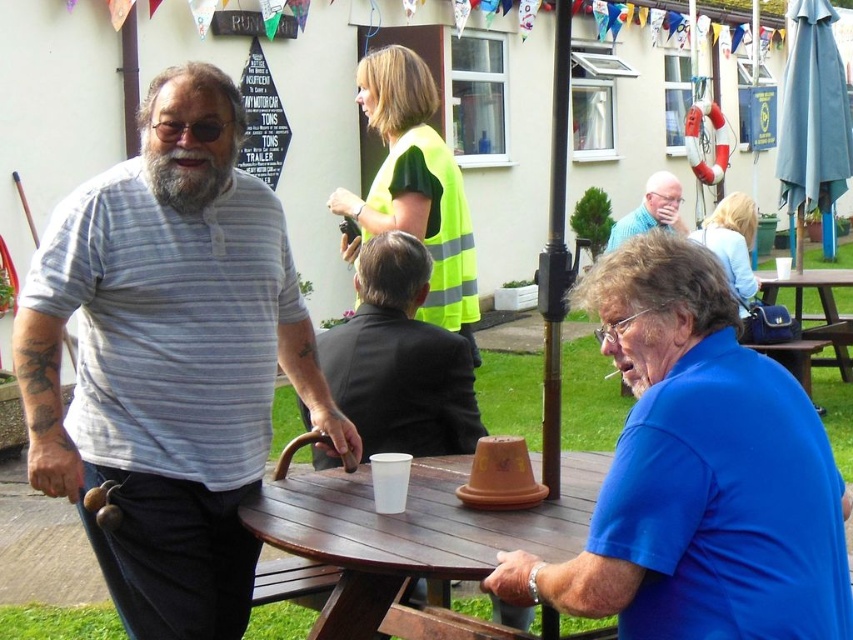
Question: From the image, what is the correct spatial relationship of blue matte shirt at center in relation to blue cotton shirt at upper right?

Choices:
 (A) left
 (B) right

Answer: (A)

Question: Estimate the real-world distances between objects in this image. Which object is closer to the blue cotton shirt at upper right?

Choices:
 (A) gray striped shirt at left
 (B) matte black suit at center
 (C) wooden table at center

Answer: (B)

Question: Considering the real-world distances, which object is farthest from the matte black suit at center?

Choices:
 (A) brown wooden table at lower right
 (B) gray striped shirt at left

Answer: (A)

Question: Is brown wooden table at lower right bigger than blue cotton shirt at upper right?

Choices:
 (A) yes
 (B) no

Answer: (A)

Question: Among these points, which one is nearest to the camera?

Choices:
 (A) (372, 301)
 (B) (201, 154)

Answer: (B)

Question: Does wooden table at center appear under brown wooden table at lower right?

Choices:
 (A) no
 (B) yes

Answer: (B)